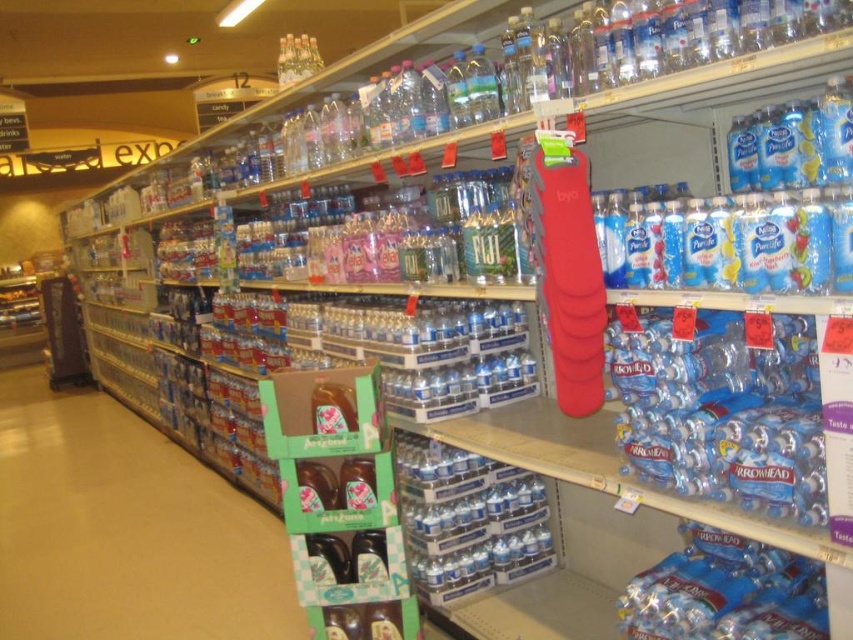
Consider the image. You are a customer trying to choose between the translucent plastic water bottle at center and the clear glass bottles at upper center. Which one has a bigger capacity?

The translucent plastic water bottle at center has a larger size compared to the clear glass bottles at upper center, so it has a bigger capacity.

You are a store employee organizing the grocery aisle. You have a green cardboard box at lower left and a translucent plastic water bottle at center. Which item has a greater width?

The green cardboard box at lower left has a greater width than the translucent plastic water bottle at center.

You are a store employee who needs to reach the green cardboard box at lower left to restock. Considering the height of the average employee is 5 feet 6 inches, and the box is placed on a standard shelf, can you safely reach the box without a ladder?

The green cardboard box at lower left is 10.97 feet away from the camera. Since the distance is measured from the camera, not the height, the height of the box on the shelf would need to be considered. However, the description does not provide the vertical height of the shelf, so it is unclear if the employee can reach it without a ladder. Additional information about the shelf height is required to determine accessibility.